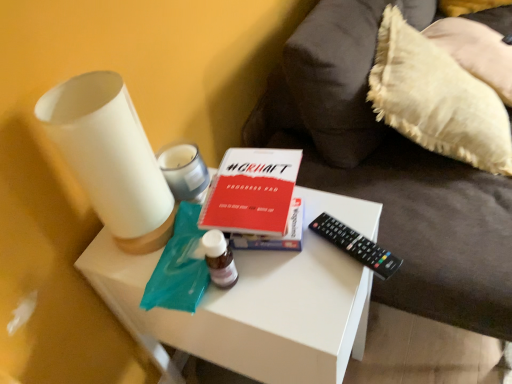
Where is `vacant area situated to the left side of black plastic remote at right`? vacant area situated to the left side of black plastic remote at right is located at coordinates (289, 282).